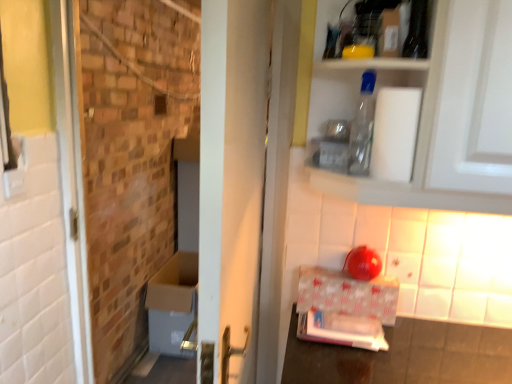
Question: Should I look upward or downward to see white glossy cardboard box at lower right?

Choices:
 (A) down
 (B) up

Answer: (A)

Question: Is white matte toilet paper at upper right in front of transparent plastic bottle at upper center?

Choices:
 (A) no
 (B) yes

Answer: (B)

Question: From a real-world perspective, is white matte toilet paper at upper right over transparent plastic bottle at upper center?

Choices:
 (A) yes
 (B) no

Answer: (B)

Question: Does white matte toilet paper at upper right have a lesser height compared to transparent plastic bottle at upper center?

Choices:
 (A) yes
 (B) no

Answer: (A)

Question: Can you confirm if white matte toilet paper at upper right is smaller than transparent plastic bottle at upper center?

Choices:
 (A) no
 (B) yes

Answer: (A)

Question: From the image's perspective, is white matte toilet paper at upper right beneath transparent plastic bottle at upper center?

Choices:
 (A) yes
 (B) no

Answer: (A)

Question: Is white matte toilet paper at upper right not within transparent plastic bottle at upper center?

Choices:
 (A) no
 (B) yes

Answer: (B)

Question: Is white matte toilet paper at upper right directly adjacent to white glossy door at center?

Choices:
 (A) no
 (B) yes

Answer: (A)

Question: From a real-world perspective, is white matte toilet paper at upper right physically above white glossy door at center?

Choices:
 (A) no
 (B) yes

Answer: (B)

Question: Is the depth of white matte toilet paper at upper right greater than that of white glossy door at center?

Choices:
 (A) yes
 (B) no

Answer: (A)

Question: Is white matte toilet paper at upper right facing away from white glossy door at center?

Choices:
 (A) no
 (B) yes

Answer: (A)

Question: From the image's perspective, is white matte toilet paper at upper right on white glossy door at center?

Choices:
 (A) yes
 (B) no

Answer: (A)

Question: From the image's perspective, is white matte toilet paper at upper right below white glossy door at center?

Choices:
 (A) no
 (B) yes

Answer: (A)

Question: Is brickwork at left surrounding white matte toilet paper at upper right?

Choices:
 (A) no
 (B) yes

Answer: (A)